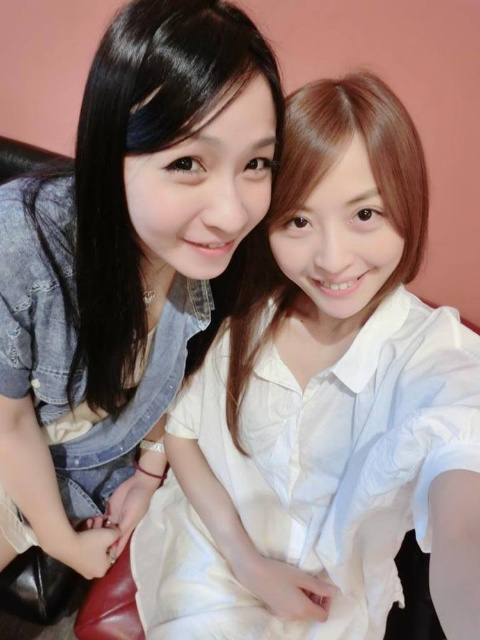
Question: Does denim jacket at left have a greater width compared to white glossy shirt at center?

Choices:
 (A) yes
 (B) no

Answer: (A)

Question: Can you confirm if denim jacket at left is smaller than white glossy shirt at center?

Choices:
 (A) yes
 (B) no

Answer: (B)

Question: Which of the following is the closest to the observer?

Choices:
 (A) (175, 268)
 (B) (276, 179)

Answer: (B)

Question: Does denim jacket at left have a greater width compared to white glossy shirt at center?

Choices:
 (A) no
 (B) yes

Answer: (B)

Question: Based on their relative distances, which object is nearer to the white cotton shirt at center?

Choices:
 (A) denim jacket at left
 (B) white glossy shirt at center

Answer: (B)

Question: Which of the following is the closest to the observer?

Choices:
 (A) white glossy shirt at center
 (B) denim jacket at left
 (C) white cotton shirt at center

Answer: (C)